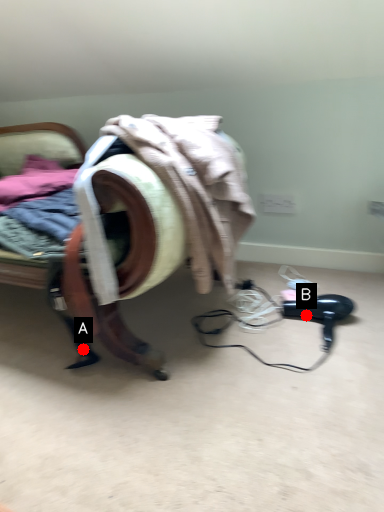
Question: Two points are circled on the image, labeled by A and B beside each circle. Which of the following is the farthest from the observer?

Choices:
 (A) A is further
 (B) B is further

Answer: (B)